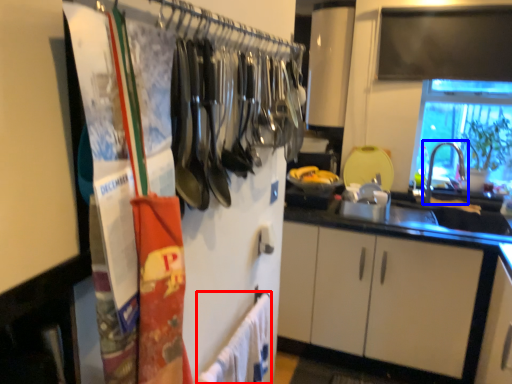
Question: Which point is further to the camera, bath towel (highlighted by a red box) or faucet (highlighted by a blue box)?

Choices:
 (A) bath towel
 (B) faucet

Answer: (B)